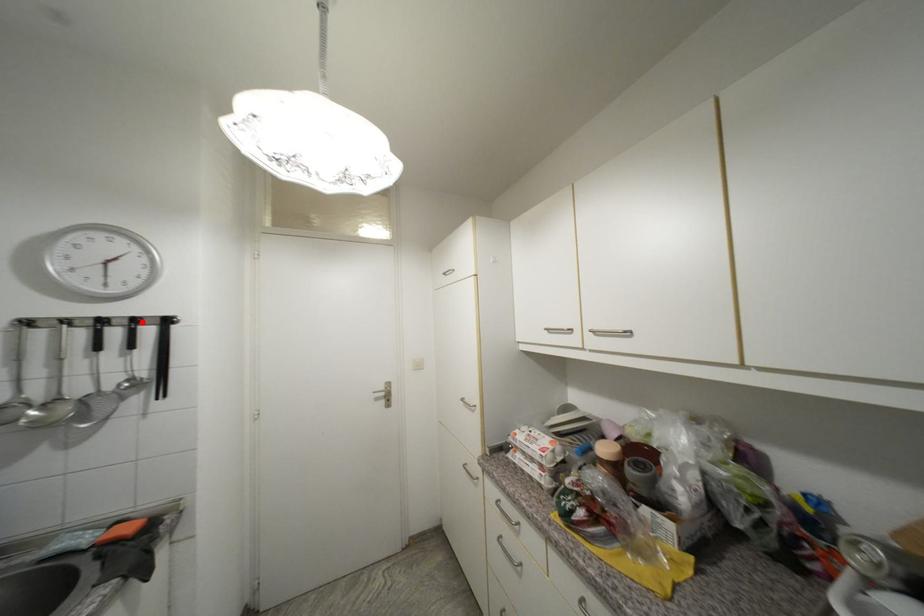
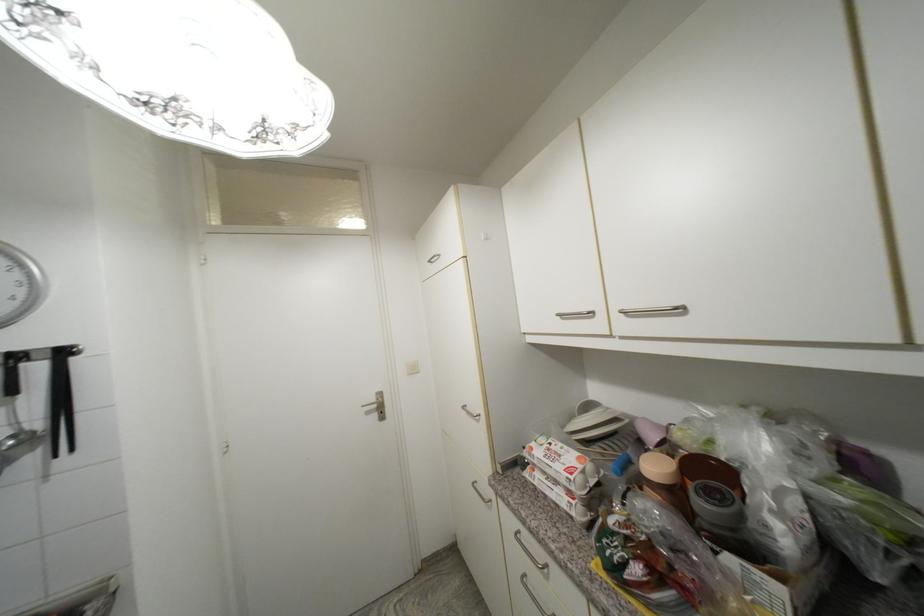
In the second image, find the point that corresponds to the highlighted location in the first image.

(22, 359)